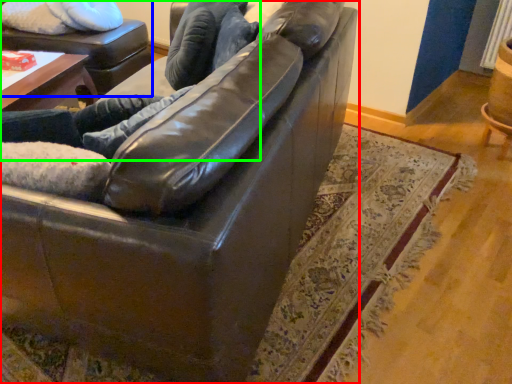
Question: Which is farther away from studio couch (highlighted by a red box)? swivel chair (highlighted by a blue box) or couple (highlighted by a green box)?

Choices:
 (A) swivel chair
 (B) couple

Answer: (A)